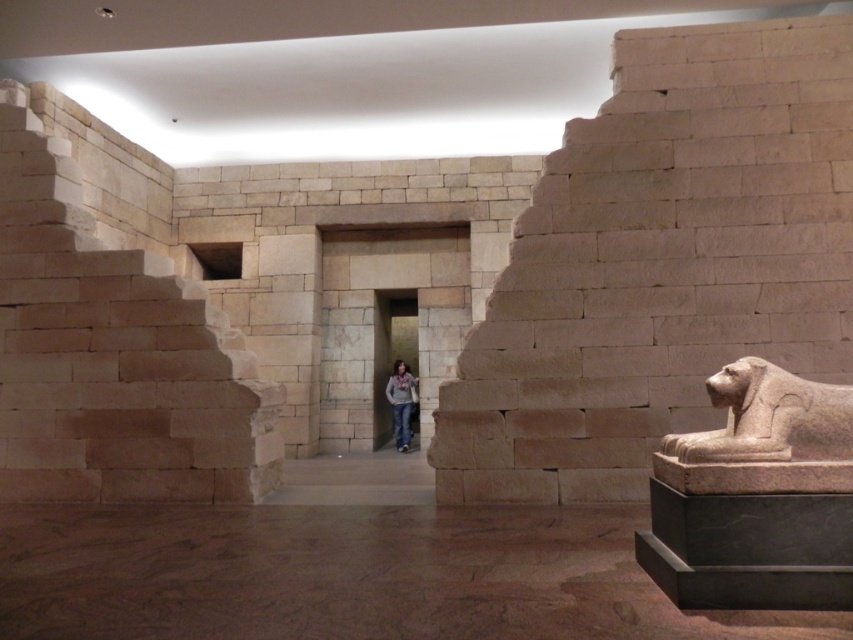
Question: Does beige stone stairs at left appear on the left side of light brown leather jacket at center?

Choices:
 (A) yes
 (B) no

Answer: (A)

Question: Which point is closer to the camera?

Choices:
 (A) smooth stone sphinx at right
 (B) beige stone stairs at center
 (C) light brown leather jacket at center
 (D) beige stone stairs at left

Answer: (A)

Question: Estimate the real-world distances between objects in this image. Which object is closer to the smooth stone sphinx at right?

Choices:
 (A) beige stone stairs at center
 (B) light brown leather jacket at center

Answer: (A)

Question: Can you confirm if smooth stone sphinx at right is positioned to the left of light brown leather jacket at center?

Choices:
 (A) yes
 (B) no

Answer: (B)

Question: Can you confirm if smooth stone sphinx at right is wider than light brown leather jacket at center?

Choices:
 (A) no
 (B) yes

Answer: (B)

Question: Which of the following is the farthest from the observer?

Choices:
 (A) smooth stone sphinx at right
 (B) beige stone stairs at center

Answer: (B)